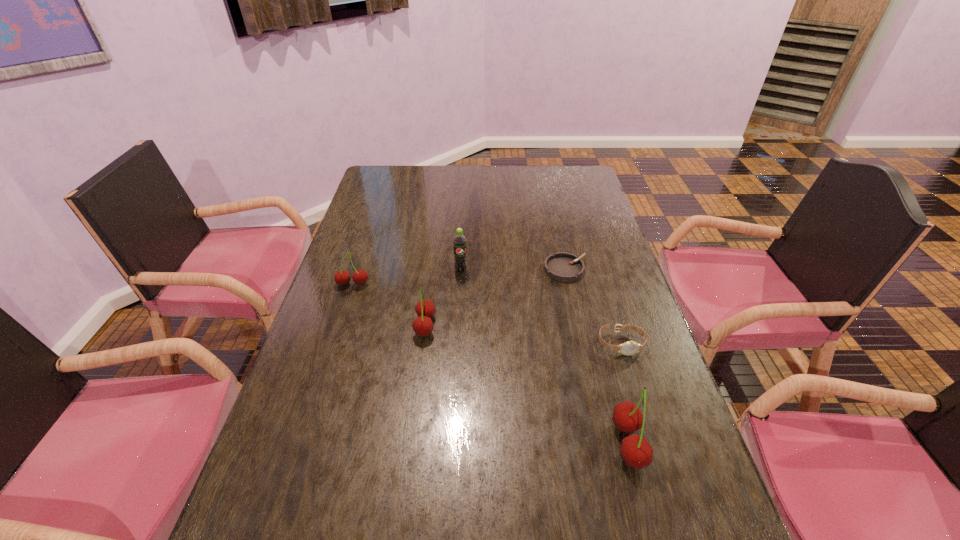
The image size is (960, 540). Find the location of `ashtray present at the right edge`. ashtray present at the right edge is located at coordinates (562, 266).

In the image, there is a desktop. Where is `free region at the far edge`? free region at the far edge is located at coordinates coord(476,181).

Locate an element on the screen. This screenshot has height=540, width=960. vacant space at the near edge of the desktop is located at coordinates (458, 524).

Where is `vacant space at the left edge of the desktop`? vacant space at the left edge of the desktop is located at coordinates (376, 207).

Identify the location of vacant region at the right edge of the desktop. (660, 472).

In the image, there is a desktop. At what (x,y) coordinates should I click in order to perform the action: click on vacant space at the far left corner. Please return your answer as a coordinate pair (x, y). The image size is (960, 540). Looking at the image, I should click on (396, 184).

You are a GUI agent. You are given a task and a screenshot of the screen. Output one action in this format:
    pyautogui.click(x=<x>, y=<y>)
    Task: Click on the free space at the near left corner of the desktop
    This screenshot has width=960, height=540.
    Given the screenshot: What is the action you would take?
    pyautogui.click(x=249, y=498)

You are a GUI agent. You are given a task and a screenshot of the screen. Output one action in this format:
    pyautogui.click(x=<x>, y=<y>)
    Task: Click on the free region at the far right corner of the desktop
    
    Given the screenshot: What is the action you would take?
    pyautogui.click(x=588, y=193)

This screenshot has width=960, height=540. Identify the location of empty space between the watch and the soda. (x=540, y=307).

Identify the location of vacant area that lies between the second cherry from right to left and the watch. This screenshot has height=540, width=960. (523, 335).